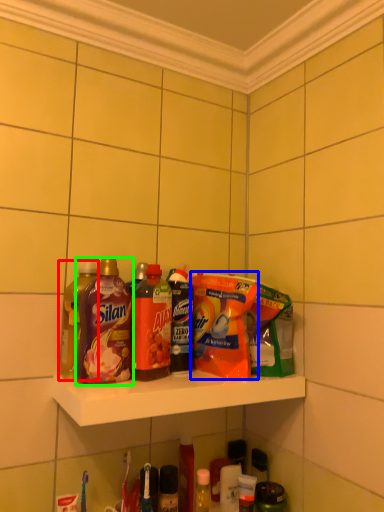
Question: Which object is the closest to the bottle (highlighted by a red box)? Choose among these: cleaning product (highlighted by a blue box) or bottle (highlighted by a green box).

Choices:
 (A) cleaning product
 (B) bottle

Answer: (B)